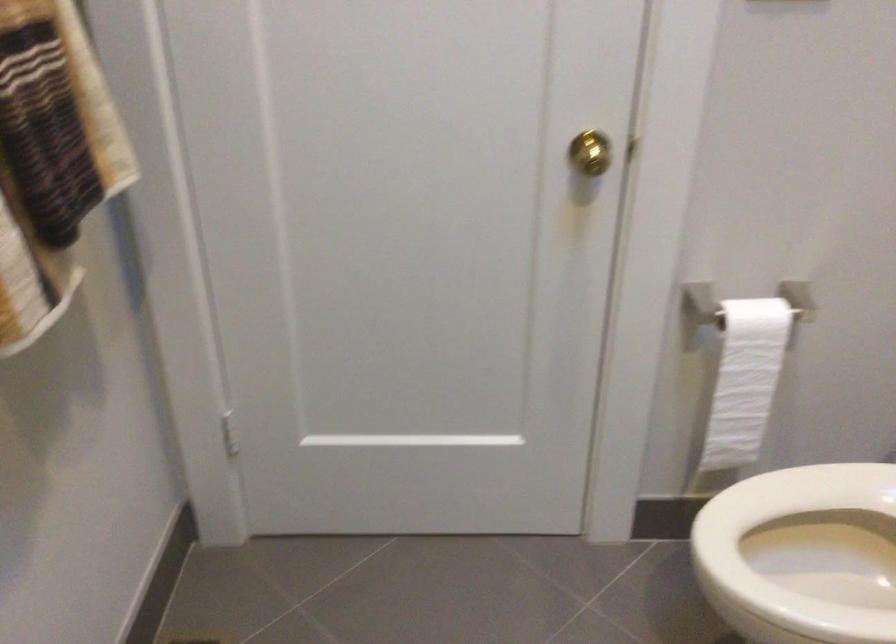
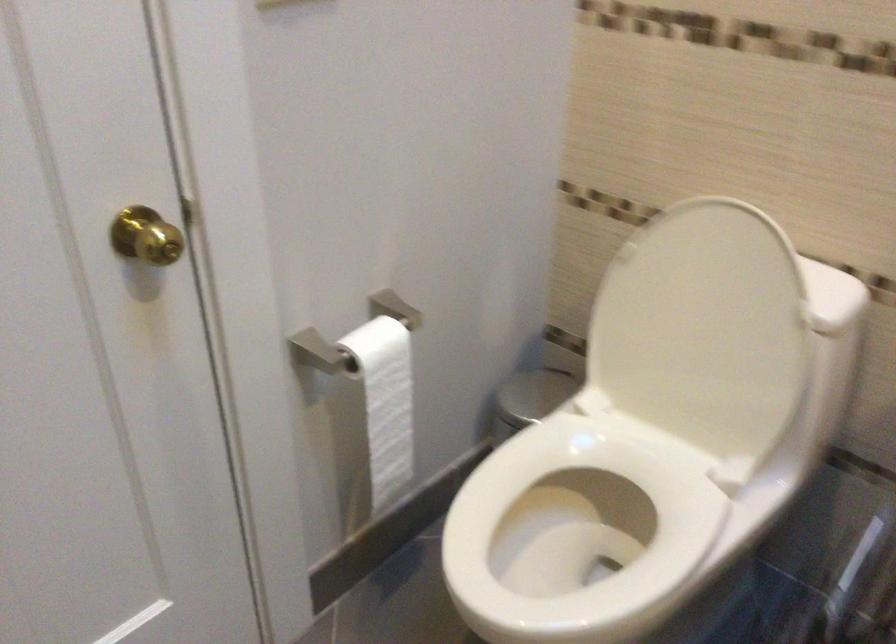
Question: Based on the continuous images, in which direction is the camera rotating? Reply with the corresponding letter.

Choices:
 (A) Left
 (B) Right
 (C) Up
 (D) Down

Answer: (B)